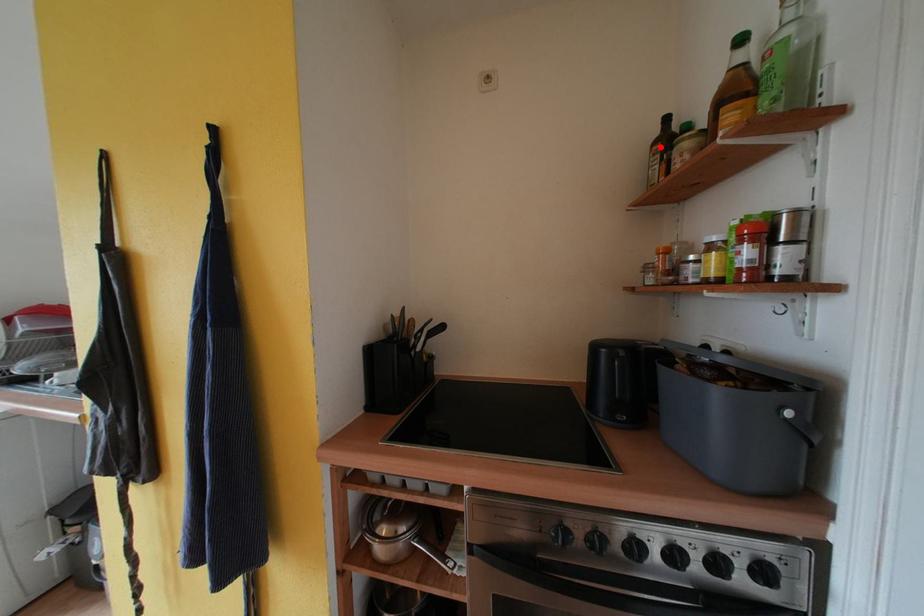
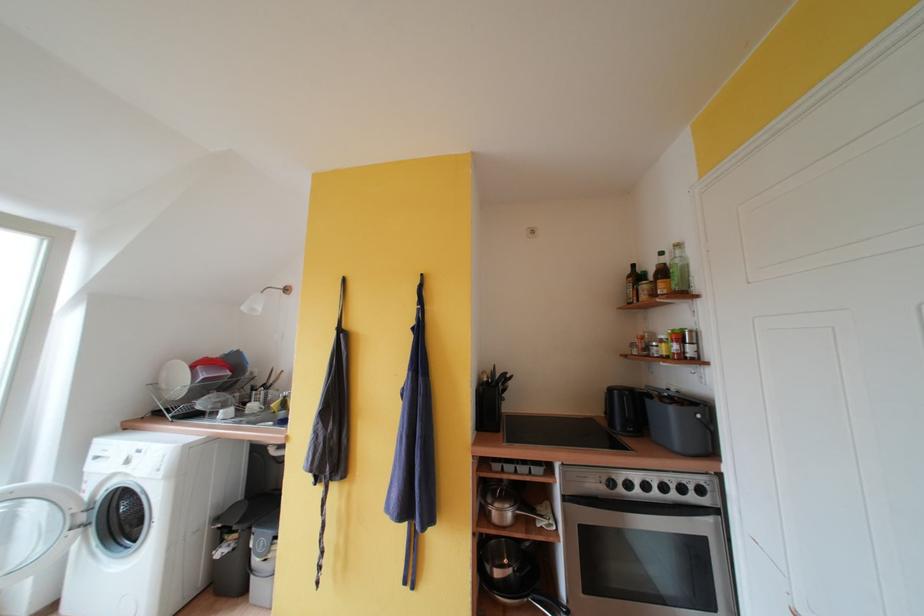
Where in the second image is the point corresponding to the highlighted location from the first image?

(634, 281)